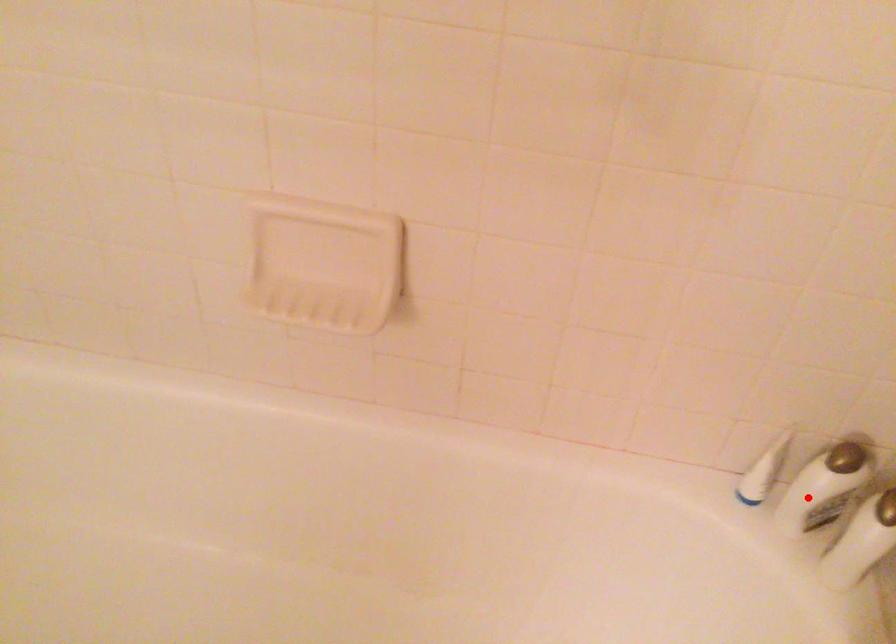
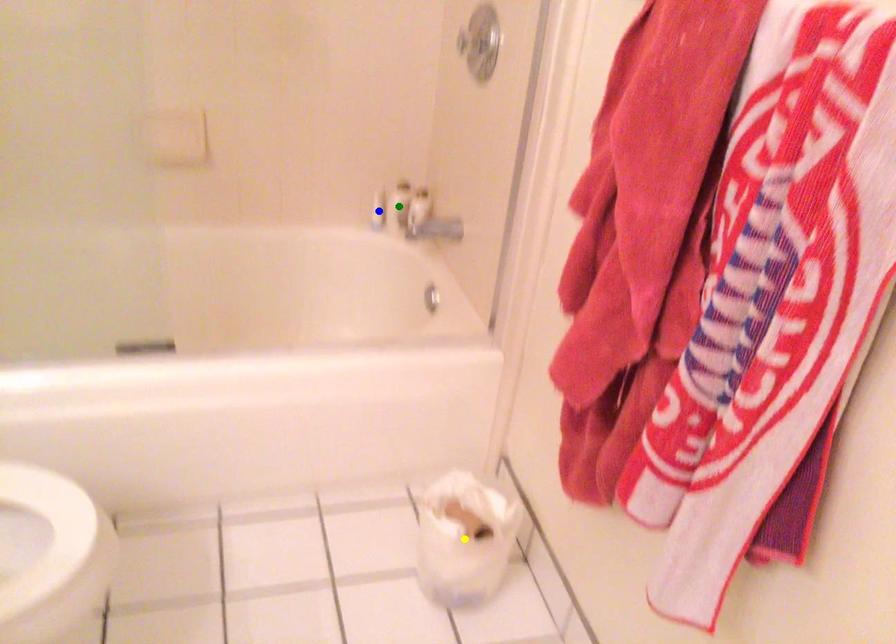
Question: I am providing you with two images of the same scene from different viewpoints. A red point is marked on the first image. You are given multiple points on the second image. Which mark in image 2 goes with the point in image 1?

Choices:
 (A) green point
 (B) yellow point
 (C) blue point

Answer: (A)